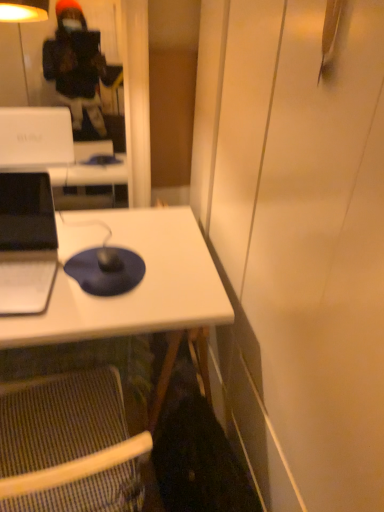
Find the location of a particular element. The height and width of the screenshot is (512, 384). vacant area that is in front of blue matte mousepad at center is located at coordinates (77, 313).